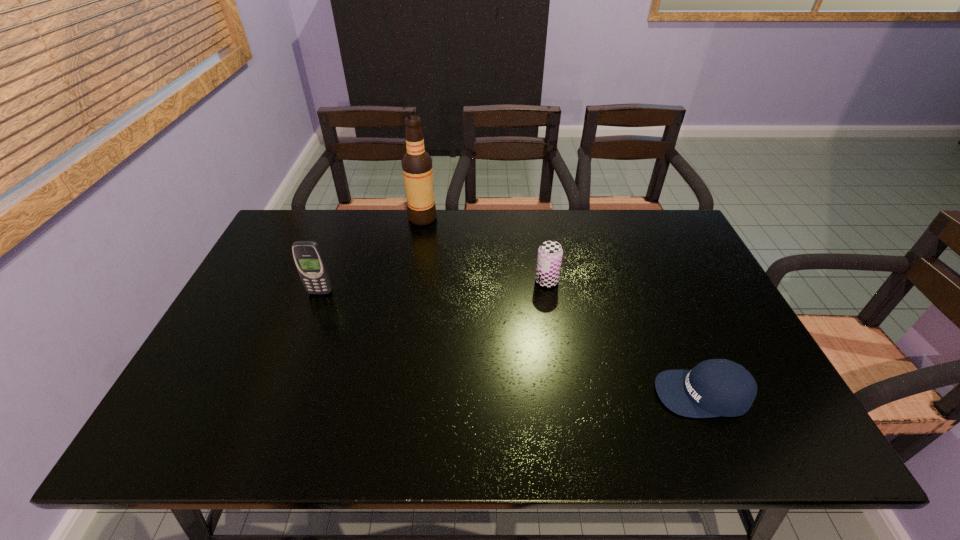
You are a GUI agent. You are given a task and a screenshot of the screen. Output one action in this format:
    pyautogui.click(x=<x>, y=<y>)
    Task: Click on the free space at the left edge of the desktop
    This screenshot has height=540, width=960.
    Given the screenshot: What is the action you would take?
    pyautogui.click(x=249, y=289)

At what (x,y) coordinates should I click in order to perform the action: click on vacant space at the right edge. Please return your answer as a coordinate pair (x, y). The width and height of the screenshot is (960, 540). Looking at the image, I should click on (751, 408).

Image resolution: width=960 pixels, height=540 pixels. In the image, there is a desktop. In order to click on vacant space at the far left corner in this screenshot , I will do `click(317, 229)`.

Identify the location of free space at the far right corner. (x=654, y=210).

Image resolution: width=960 pixels, height=540 pixels. Identify the location of free location at the near right corner of the desktop. (763, 424).

Image resolution: width=960 pixels, height=540 pixels. In order to click on free spot between the cellular telephone and the tallest object in this screenshot , I will do `click(372, 255)`.

Find the location of a particular element. This screenshot has height=540, width=960. vacant point located between the third nearest object and the third farthest object is located at coordinates (433, 287).

This screenshot has width=960, height=540. What are the coordinates of `vacant space that is in between the farthest object and the cellular telephone` in the screenshot? It's located at (372, 255).

Identify the location of free spot between the farthest object and the rightmost object. (563, 306).

I want to click on free space that is in between the third farthest object and the baseball cap, so click(512, 343).